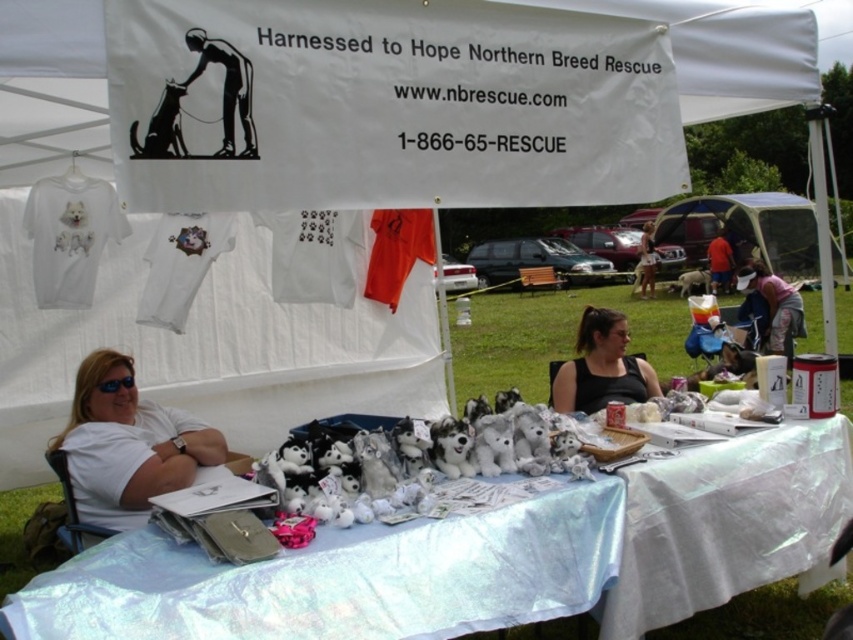
Is point (575, 586) farther from camera compared to point (689, 292)?

That is False.

This screenshot has height=640, width=853. Identify the location of white fabric table at center. (328, 557).

Is white fabric canopy at upper center further to the viewer compared to white plush dog at center?

No, white fabric canopy at upper center is in front of white plush dog at center.

Is white fabric canopy at upper center positioned in front of white plush dog at center?

Yes, it is in front of white plush dog at center.

Where is `white fabric canopy at upper center`? This screenshot has width=853, height=640. white fabric canopy at upper center is located at coordinates (51, 88).

Is white fabric canopy at upper center shorter than light brown hair at center?

Correct, white fabric canopy at upper center is not as tall as light brown hair at center.

Can you confirm if white fabric canopy at upper center is thinner than light brown hair at center?

Correct, white fabric canopy at upper center's width is less than light brown hair at center's.

Is point (711, 93) farther from camera compared to point (641, 248)?

No, it is not.

The image size is (853, 640). I want to click on white fabric canopy at upper center, so click(x=51, y=88).